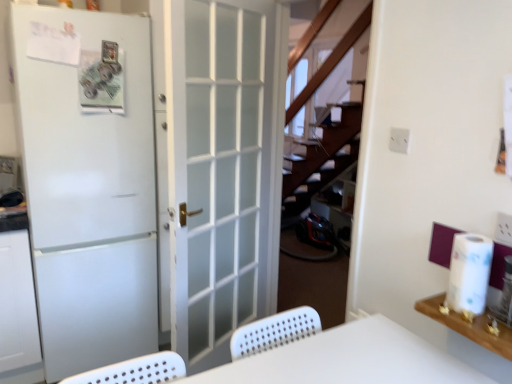
Describe the element at coordinates (88, 182) in the screenshot. I see `white matte door at left, arranged as the 2th door when viewed from the right` at that location.

Where is `white frosted glass door at center, the first door from the right`? white frosted glass door at center, the first door from the right is located at coordinates (219, 165).

From their relative heights in the image, would you say white paper at right is taller or shorter than white frosted glass door at center, the first door from the right?

Considering their sizes, white paper at right has less height than white frosted glass door at center, the first door from the right.

Considering the sizes of white paper at right and white frosted glass door at center, the first door from the right, in the image, is white paper at right wider or thinner than white frosted glass door at center, the first door from the right,?

Clearly, white paper at right has less width compared to white frosted glass door at center, the first door from the right.

Is white paper at right located outside white frosted glass door at center, the first door from the right?

Yes.

Is point (472, 290) closer to camera compared to point (227, 333)?

Yes, point (472, 290) is in front of point (227, 333).

Between white frosted glass door at center, the first door from the right, and white paper at right, which one has larger width?

white frosted glass door at center, the first door from the right, is wider.

Is white frosted glass door at center, arranged as the 2th door when viewed from the left, further to camera compared to white paper at right?

Yes, white frosted glass door at center, arranged as the 2th door when viewed from the left, is further from the camera.

Is white frosted glass door at center, arranged as the 2th door when viewed from the left, facing towards white paper at right?

Yes, white frosted glass door at center, arranged as the 2th door when viewed from the left, is turned towards white paper at right.

Is point (222, 42) closer or farther from the camera than point (455, 260)?

Point (222, 42) appears to be farther away from the viewer than point (455, 260).

What are the coordinates of `counter top below the white matte door at left, arranged as the 2th door when viewed from the right (from a real-world perspective)` in the screenshot? It's located at (469, 326).

Based on the photo, from the image's perspective, which object appears higher, white wood shelf at upper right or white matte door at left, which ranks as the first door in left-to-right order?

white matte door at left, which ranks as the first door in left-to-right order.

In the scene shown: Considering the relative positions of white wood shelf at upper right and white matte door at left, arranged as the 2th door when viewed from the right, in the image provided, is white wood shelf at upper right to the right of white matte door at left, arranged as the 2th door when viewed from the right, from the viewer's perspective?

Yes, white wood shelf at upper right is to the right of white matte door at left, arranged as the 2th door when viewed from the right.

Is white wood shelf at upper right facing towards white matte door at left, which ranks as the first door in left-to-right order?

No, white wood shelf at upper right is not aimed at white matte door at left, which ranks as the first door in left-to-right order.

Can you tell me how much white matte door at left, which ranks as the first door in left-to-right order, and white paper at right differ in facing direction?

The angle between the facing direction of white matte door at left, which ranks as the first door in left-to-right order, and the facing direction of white paper at right is 90.6 degrees.

Which object is closer to the camera, white matte door at left, which ranks as the first door in left-to-right order, or white paper at right?

Positioned in front is white paper at right.

From the picture: Looking at their sizes, would you say white matte door at left, which ranks as the first door in left-to-right order, is wider or thinner than white paper at right?

In the image, white matte door at left, which ranks as the first door in left-to-right order, appears to be wider than white paper at right.

From a real-world perspective, which door is the 2nd one underneath the white paper at right? Please provide its 2D coordinates.

[(88, 182)]

Could you measure the distance between white frosted glass door at center, the first door from the right, and white matte door at left, arranged as the 2th door when viewed from the right?

white frosted glass door at center, the first door from the right, and white matte door at left, arranged as the 2th door when viewed from the right, are 16.54 inches apart.

Based on the photo, is white frosted glass door at center, the first door from the right, facing towards white matte door at left, arranged as the 2th door when viewed from the right?

No, white frosted glass door at center, the first door from the right, is not aimed at white matte door at left, arranged as the 2th door when viewed from the right.

Considering the relative positions of white frosted glass door at center, arranged as the 2th door when viewed from the left, and white matte door at left, arranged as the 2th door when viewed from the right, in the image provided, is white frosted glass door at center, arranged as the 2th door when viewed from the left, to the right of white matte door at left, arranged as the 2th door when viewed from the right, from the viewer's perspective?

Indeed, white frosted glass door at center, arranged as the 2th door when viewed from the left, is positioned on the right side of white matte door at left, arranged as the 2th door when viewed from the right.

You are a GUI agent. You are given a task and a screenshot of the screen. Output one action in this format:
    pyautogui.click(x=<x>, y=<y>)
    Task: Click on the door in front of the white matte door at left, arranged as the 2th door when viewed from the right
    Image resolution: width=512 pixels, height=384 pixels.
    Given the screenshot: What is the action you would take?
    pyautogui.click(x=219, y=165)

Can you confirm if white plastic table at center is positioned to the right of white matte door at left, which ranks as the first door in left-to-right order?

Indeed, white plastic table at center is positioned on the right side of white matte door at left, which ranks as the first door in left-to-right order.

How different are the orientations of white plastic table at center and white matte door at left, which ranks as the first door in left-to-right order, in degrees?

0.637 degrees.

Can you confirm if white plastic table at center is wider than white matte door at left, arranged as the 2th door when viewed from the right?

No.

Is white plastic table at center inside or outside of white matte door at left, arranged as the 2th door when viewed from the right?

white plastic table at center exists outside the volume of white matte door at left, arranged as the 2th door when viewed from the right.

Which is more to the right, white paper at right or white wood shelf at upper right?

From the viewer's perspective, white wood shelf at upper right appears more on the right side.

Locate an element on the screen. counter top below the white paper at right (from a real-world perspective) is located at coordinates (469, 326).

Starting from the white paper at right, which door is the 1st one behind? Please provide its 2D coordinates.

[(219, 165)]

Where is `paper towel on the right of white frosted glass door at center, arranged as the 2th door when viewed from the left`? Image resolution: width=512 pixels, height=384 pixels. paper towel on the right of white frosted glass door at center, arranged as the 2th door when viewed from the left is located at coordinates (469, 274).

Estimate the real-world distances between objects in this image. Which object is further from white plastic table at center, white paper at right or white matte door at left, which ranks as the first door in left-to-right order?

white matte door at left, which ranks as the first door in left-to-right order.

Looking at this image, from the image, which object appears to be farther from white frosted glass door at center, the first door from the right, white matte door at left, arranged as the 2th door when viewed from the right, or white wood shelf at upper right?

Based on the image, white wood shelf at upper right appears to be further to white frosted glass door at center, the first door from the right.

Based on their spatial positions, is white matte door at left, arranged as the 2th door when viewed from the right, or white wood shelf at upper right further from white paper at right?

Among the two, white matte door at left, arranged as the 2th door when viewed from the right, is located further to white paper at right.

Estimate the real-world distances between objects in this image. Which object is closer to white matte door at left, which ranks as the first door in left-to-right order, white plastic table at center or white paper at right?

The object closer to white matte door at left, which ranks as the first door in left-to-right order, is white plastic table at center.

Looking at the image, which one is located closer to white frosted glass door at center, the first door from the right, white wood shelf at upper right or white matte door at left, which ranks as the first door in left-to-right order?

white matte door at left, which ranks as the first door in left-to-right order, lies closer to white frosted glass door at center, the first door from the right, than the other object.

Based on their spatial positions, is white wood shelf at upper right or white matte door at left, arranged as the 2th door when viewed from the right, further from white plastic table at center?

white matte door at left, arranged as the 2th door when viewed from the right.

From the picture: From the image, which object appears to be nearer to white paper at right, white matte door at left, which ranks as the first door in left-to-right order, or white frosted glass door at center, arranged as the 2th door when viewed from the left?

white frosted glass door at center, arranged as the 2th door when viewed from the left, is closer to white paper at right.

Considering their positions, is white paper at right positioned further to white frosted glass door at center, arranged as the 2th door when viewed from the left, than white plastic table at center?

Based on the image, white paper at right appears to be further to white frosted glass door at center, arranged as the 2th door when viewed from the left.

I want to click on paper towel located between white plastic table at center and white wood shelf at upper right in the left-right direction, so click(469, 274).

I want to click on door between white matte door at left, arranged as the 2th door when viewed from the right, and white paper at right, in the horizontal direction, so click(x=219, y=165).

This screenshot has height=384, width=512. I want to click on furniture between white frosted glass door at center, the first door from the right, and white wood shelf at upper right from left to right, so click(x=348, y=359).

What are the coordinates of `furniture between white frosted glass door at center, the first door from the right, and white paper at right from left to right` in the screenshot? It's located at (348, 359).